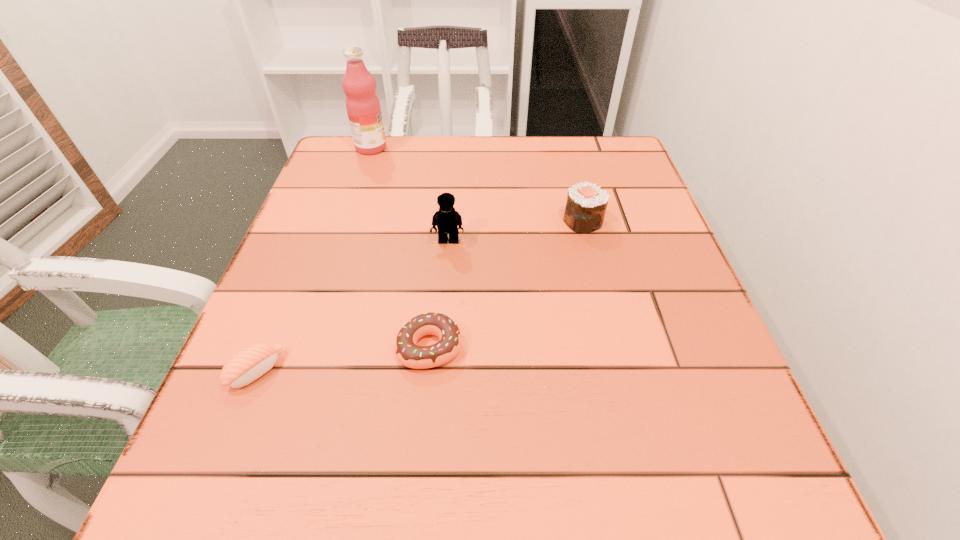
Find the location of a particular element. The image size is (960, 540). blank area at the left edge is located at coordinates (265, 396).

This screenshot has height=540, width=960. Identify the location of blank area at the right edge. (719, 364).

Where is `blank area at the near left corner`? blank area at the near left corner is located at coordinates (157, 524).

The width and height of the screenshot is (960, 540). I want to click on vacant area at the far right corner, so click(x=597, y=150).

The image size is (960, 540). In the image, there is a desktop. Find the location of `vacant space at the near right corner`. vacant space at the near right corner is located at coordinates (694, 461).

Find the location of a particular element. vacant point located between the Lego and the shorter sushi is located at coordinates (352, 306).

You are a GUI agent. You are given a task and a screenshot of the screen. Output one action in this format:
    pyautogui.click(x=<x>, y=<y>)
    Task: Click on the empty location between the tallest object and the left sushi
    
    Given the screenshot: What is the action you would take?
    pyautogui.click(x=314, y=259)

Where is `vacant space that is in between the second tallest object and the nearer sushi`? This screenshot has height=540, width=960. vacant space that is in between the second tallest object and the nearer sushi is located at coordinates (352, 306).

At what (x,y) coordinates should I click in order to perform the action: click on free point between the farther sushi and the left sushi. Please return your answer as a coordinate pair (x, y). This screenshot has height=540, width=960. Looking at the image, I should click on (420, 296).

Locate an element on the screen. The width and height of the screenshot is (960, 540). free point between the fruit juice and the nearer sushi is located at coordinates (314, 259).